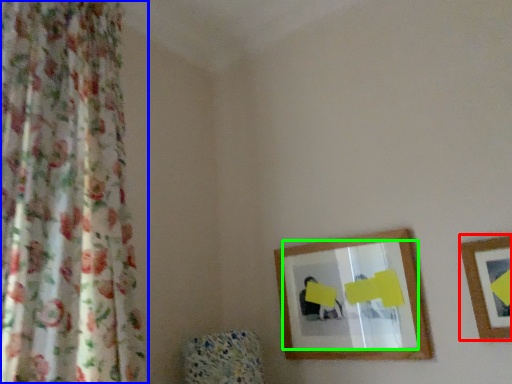
Question: Which object is positioned closest to picture frame (highlighted by a red box)? Select from curtain (highlighted by a blue box) and mirror (highlighted by a green box).

Choices:
 (A) curtain
 (B) mirror

Answer: (B)